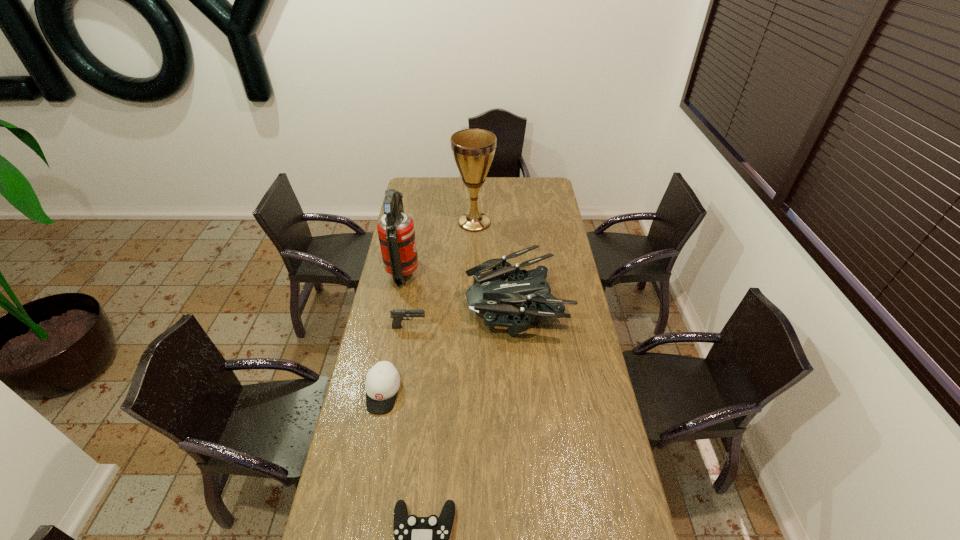
The width and height of the screenshot is (960, 540). Find the location of `free space between the third tallest object and the pistol`. free space between the third tallest object and the pistol is located at coordinates point(463,314).

Identify the location of free space between the third tallest object and the fire extinguisher. This screenshot has width=960, height=540. (460, 287).

Where is `free space between the fire extinguisher and the fifth farthest object`? The width and height of the screenshot is (960, 540). free space between the fire extinguisher and the fifth farthest object is located at coordinates (394, 332).

Locate an element on the screen. Image resolution: width=960 pixels, height=540 pixels. object that is the fifth closest to the third tallest object is located at coordinates (417, 539).

Locate an element on the screen. object identified as the third closest to the shortest object is located at coordinates (397, 314).

Find the location of `free space that satisfies the following two spatial constraints: 1. on the front label side of the fire extinguisher; 2. on the left side of the drone`. free space that satisfies the following two spatial constraints: 1. on the front label side of the fire extinguisher; 2. on the left side of the drone is located at coordinates (397, 302).

Locate an element on the screen. vacant position in the image that satisfies the following two spatial constraints: 1. on the front label side of the fire extinguisher; 2. on the back side of the fourth shortest object is located at coordinates (397, 302).